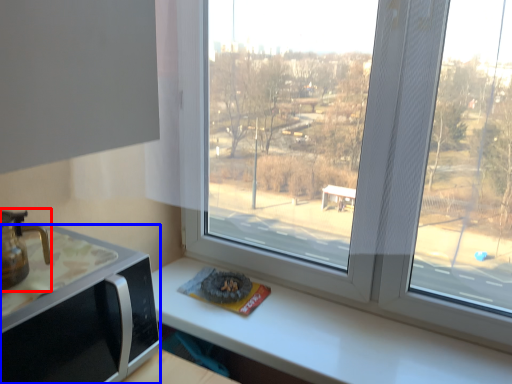
Question: Which of the following is the farthest to the observer, coffeepot (highlighted by a red box) or appliance (highlighted by a blue box)?

Choices:
 (A) coffeepot
 (B) appliance

Answer: (A)